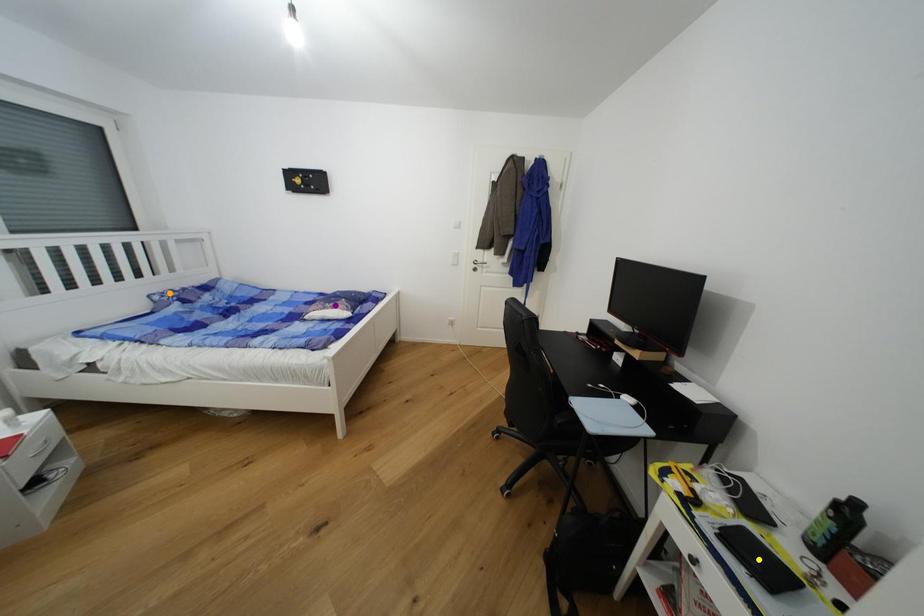
Order these from nearest to farthest:
- yellow point
- purple point
- orange point

yellow point, orange point, purple point